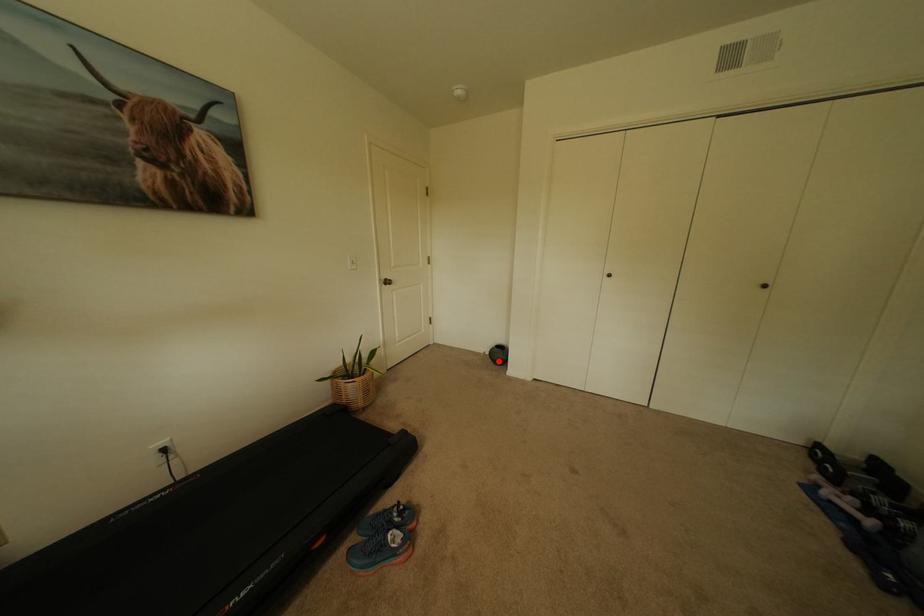
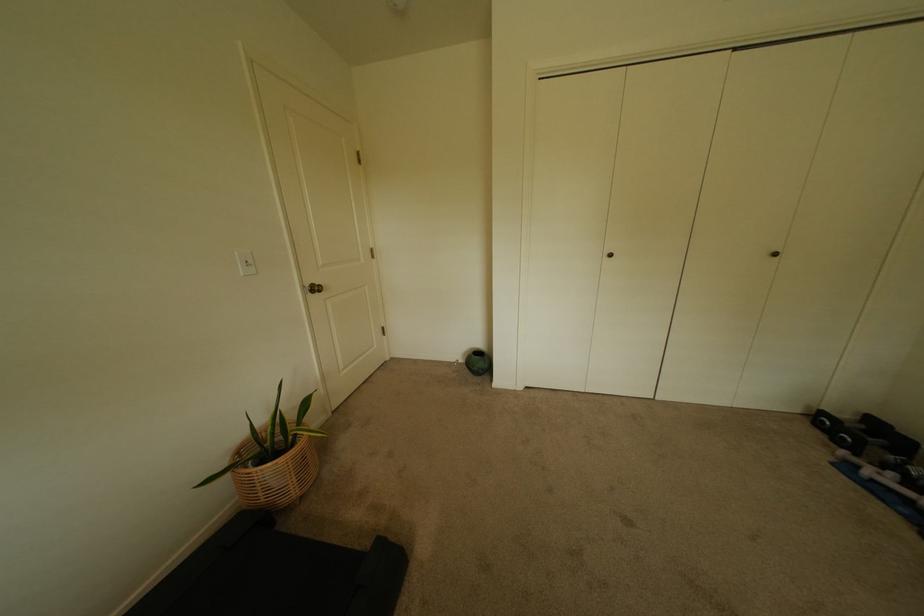
Question: I am providing you with two images of the same scene from different viewpoints. A red point is shown in image1. For the corresponding object point in image2, is it positioned nearer or farther from the camera?

Choices:
 (A) Nearer
 (B) Farther

Answer: (B)